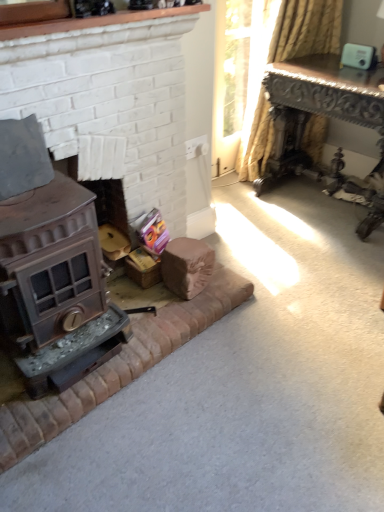
Question: In terms of width, does dark brown polished wood table at upper right look wider or thinner when compared to yellow striped fabric at upper right?

Choices:
 (A) thin
 (B) wide

Answer: (B)

Question: From the image's perspective, is dark brown polished wood table at upper right located above or below yellow striped fabric at upper right?

Choices:
 (A) below
 (B) above

Answer: (A)

Question: Estimate the real-world distances between objects in this image. Which object is farther from the yellow striped fabric at upper right?

Choices:
 (A) bronze metallic wood burning stove at lower left
 (B) matte brown wood stove at left, which is the 1th fireplace in top-to-bottom order
 (C) dark brown polished wood table at upper right
 (D) bronze metallic fireplace at lower left, arranged as the 1th fireplace when ordered from the bottom

Answer: (A)

Question: Estimate the real-world distances between objects in this image. Which object is farther from the bronze metallic fireplace at lower left, arranged as the 1th fireplace when ordered from the bottom?

Choices:
 (A) matte brown wood stove at left, placed as the second fireplace when sorted from bottom to top
 (B) dark brown polished wood table at upper right
 (C) yellow striped fabric at upper right
 (D) bronze metallic wood burning stove at lower left

Answer: (C)